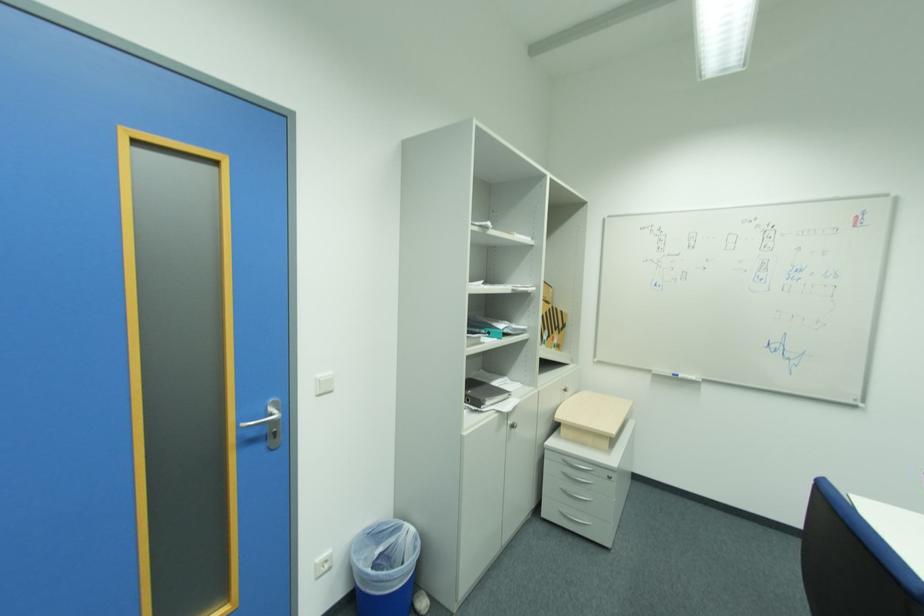
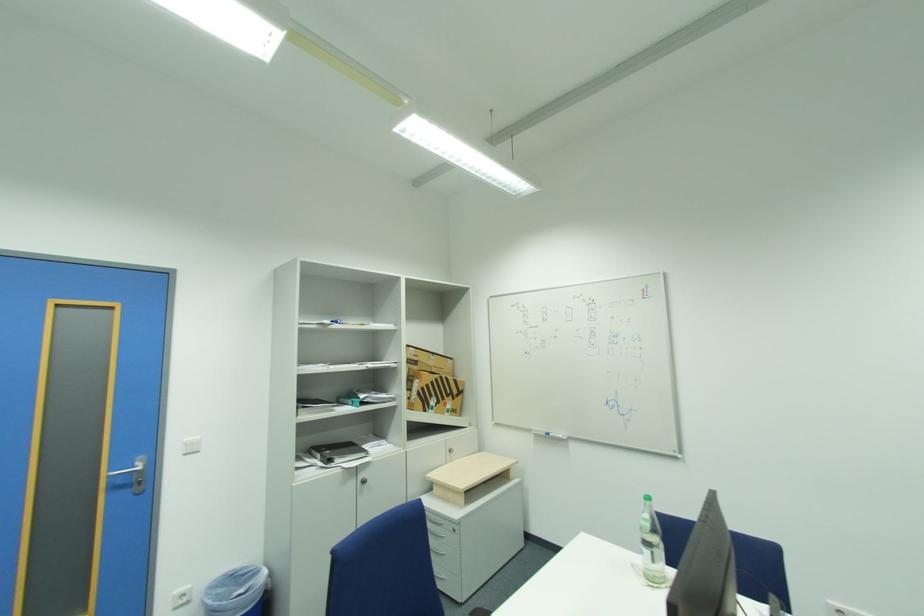
What movement of the cameraman would produce the second image?

The movement direction of the cameraman is right, backward.